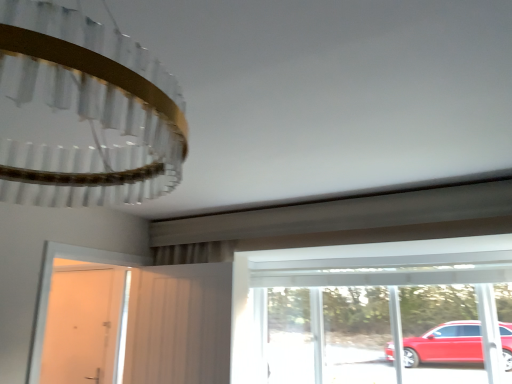
Question: From the image's perspective, is white matte door at left, arranged as the first door when viewed from the front, above or below white glossy door at left, which is the 2th door in right-to-left order?

Choices:
 (A) below
 (B) above

Answer: (B)

Question: Is point (160, 309) positioned closer to the camera than point (97, 294)?

Choices:
 (A) closer
 (B) farther

Answer: (A)

Question: Estimate the real-world distances between objects in this image. Which object is closer to the white fabric screen door at center?

Choices:
 (A) transparent glass window at center
 (B) white glossy door at left, acting as the 1th door starting from the back
 (C) white matte door at left, arranged as the first door when viewed from the front

Answer: (C)

Question: Which of these objects is positioned farthest from the white matte door at left, arranged as the first door when viewed from the front?

Choices:
 (A) transparent glass window at center
 (B) white glossy door at left, which is the 2th door in right-to-left order
 (C) white fabric screen door at center

Answer: (A)